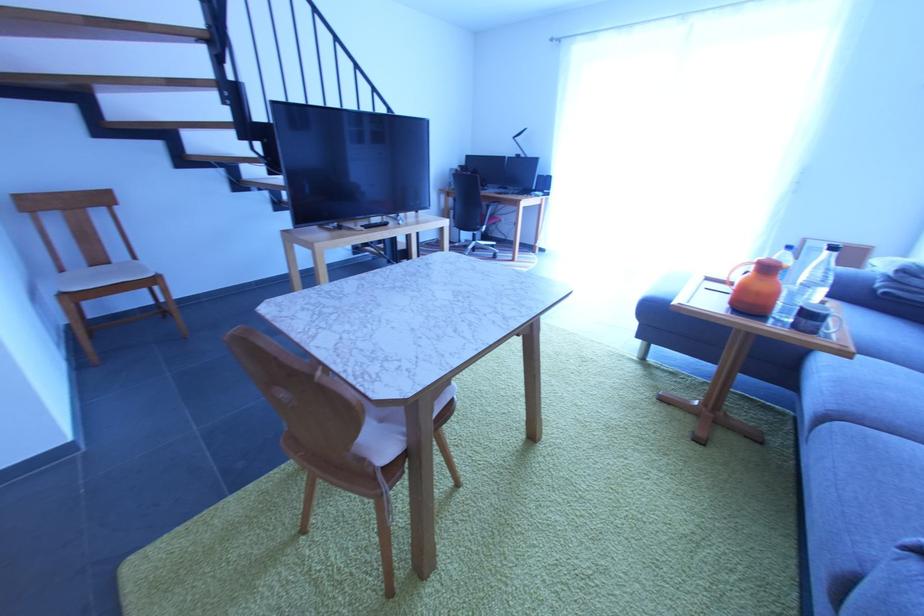
Where is `dark mug handle`? Image resolution: width=924 pixels, height=616 pixels. dark mug handle is located at coordinates (811, 318).